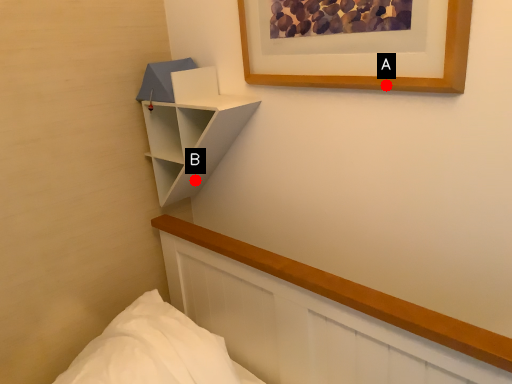
Question: Two points are circled on the image, labeled by A and B beside each circle. Which of the following is the closest to the observer?

Choices:
 (A) A is closer
 (B) B is closer

Answer: (A)